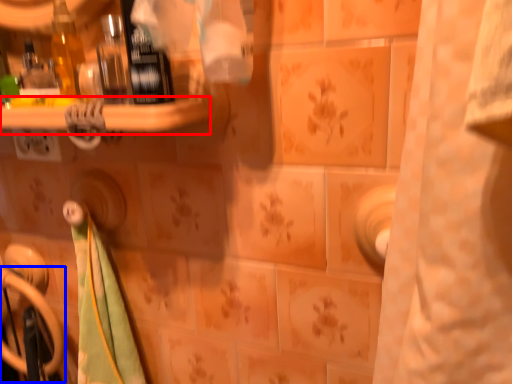
Question: Among these objects, which one is nearest to the camera, ledge (highlighted by a red box) or door handle (highlighted by a blue box)?

Choices:
 (A) ledge
 (B) door handle

Answer: (A)